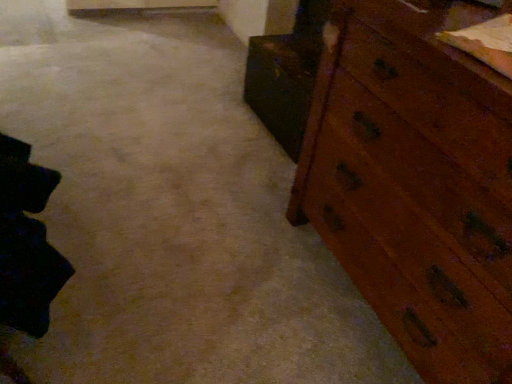
This screenshot has width=512, height=384. Describe the element at coordinates (282, 84) in the screenshot. I see `wooden cabinet at right` at that location.

The width and height of the screenshot is (512, 384). Find the location of `wooden cabinet at right`. wooden cabinet at right is located at coordinates (282, 84).

Based on the photo, measure the distance between wooden cabinet at right and camera.

The distance of wooden cabinet at right from camera is 5.65 feet.

Locate an element on the screen. This screenshot has width=512, height=384. wooden chest of drawers at right is located at coordinates (415, 182).

What do you see at coordinates (415, 182) in the screenshot?
I see `wooden chest of drawers at right` at bounding box center [415, 182].

I want to click on wooden cabinet at right, so click(x=282, y=84).

Consider the image. Is wooden cabinet at right to the left of wooden chest of drawers at right from the viewer's perspective?

Correct, you'll find wooden cabinet at right to the left of wooden chest of drawers at right.

Is the position of wooden cabinet at right more distant than that of wooden chest of drawers at right?

Yes.

Considering the points (293, 96) and (337, 191), which point is in front, point (293, 96) or point (337, 191)?

The point (337, 191) is closer.

From the image's perspective, is wooden cabinet at right below wooden chest of drawers at right?

No, from the image's perspective, wooden cabinet at right is not below wooden chest of drawers at right.

From a real-world perspective, does wooden cabinet at right stand above wooden chest of drawers at right?

Incorrect, from a real-world perspective, wooden cabinet at right is lower than wooden chest of drawers at right.

Which of these two, wooden cabinet at right or wooden chest of drawers at right, is wider?

With larger width is wooden chest of drawers at right.

Can you confirm if wooden cabinet at right is shorter than wooden chest of drawers at right?

Yes.

Considering the relative sizes of wooden cabinet at right and wooden chest of drawers at right in the image provided, is wooden cabinet at right smaller than wooden chest of drawers at right?

Yes, wooden cabinet at right is smaller than wooden chest of drawers at right.

Is wooden cabinet at right located outside wooden chest of drawers at right?

Yes.

Are wooden cabinet at right and wooden chest of drawers at right making contact?

No, wooden cabinet at right is not next to wooden chest of drawers at right.

Is wooden cabinet at right positioned with its back to wooden chest of drawers at right?

No, wooden cabinet at right's orientation is not away from wooden chest of drawers at right.

How many degrees apart are the facing directions of wooden cabinet at right and wooden chest of drawers at right?

0.918 degrees.

You are a GUI agent. You are given a task and a screenshot of the screen. Output one action in this format:
    pyautogui.click(x=<x>, y=<y>)
    Task: Click on the chest of drawers on the right of wooden cabinet at right
    The height and width of the screenshot is (384, 512).
    Given the screenshot: What is the action you would take?
    pyautogui.click(x=415, y=182)

Is wooden chest of drawers at right to the left of wooden cabinet at right from the viewer's perspective?

No, wooden chest of drawers at right is not to the left of wooden cabinet at right.

Is wooden chest of drawers at right positioned before wooden cabinet at right?

Yes, it is.

Is point (469, 320) farther from camera compared to point (292, 106)?

No.

From the image's perspective, which is below, wooden chest of drawers at right or wooden cabinet at right?

wooden chest of drawers at right appears lower in the image.

From a real-world perspective, relative to wooden cabinet at right, is wooden chest of drawers at right vertically above or below?

From a real-world perspective, wooden chest of drawers at right is physically above wooden cabinet at right.

Is wooden chest of drawers at right wider or thinner than wooden cabinet at right?

Clearly, wooden chest of drawers at right has more width compared to wooden cabinet at right.

From their relative heights in the image, would you say wooden chest of drawers at right is taller or shorter than wooden cabinet at right?

Clearly, wooden chest of drawers at right is taller compared to wooden cabinet at right.

Can you confirm if wooden chest of drawers at right is bigger than wooden cabinet at right?

Correct, wooden chest of drawers at right is larger in size than wooden cabinet at right.

Is wooden chest of drawers at right not inside wooden cabinet at right?

Yes.

Does wooden chest of drawers at right touch wooden cabinet at right?

No, wooden chest of drawers at right is not with wooden cabinet at right.

Looking at this image, is wooden chest of drawers at right oriented away from wooden cabinet at right?

No, wooden chest of drawers at right is not facing the opposite direction of wooden cabinet at right.

Can you tell me how much wooden chest of drawers at right and wooden cabinet at right differ in facing direction?

The angle between the facing direction of wooden chest of drawers at right and the facing direction of wooden cabinet at right is 0.918 degrees.

Measure the distance from wooden chest of drawers at right to wooden cabinet at right.

29.34 inches.

Locate an element on the screen. This screenshot has width=512, height=384. cabinetry above the wooden chest of drawers at right (from the image's perspective) is located at coordinates (282, 84).

What are the coordinates of `the chest of drawers lying in front of the wooden cabinet at right` in the screenshot? It's located at (415, 182).

Find the location of a particular element. Image resolution: width=512 pixels, height=384 pixels. cabinetry that is under the wooden chest of drawers at right (from a real-world perspective) is located at coordinates (282, 84).